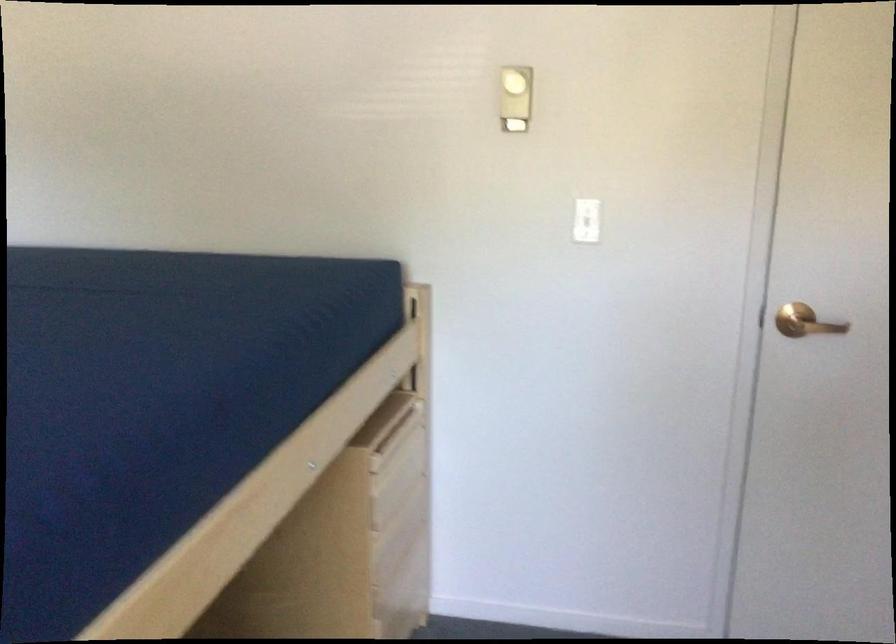
At what (x,y) coordinates should I click in order to perform the action: click on drawer handle cutout. Please return your answer as a coordinate pair (x, y). Looking at the image, I should click on (399, 429).